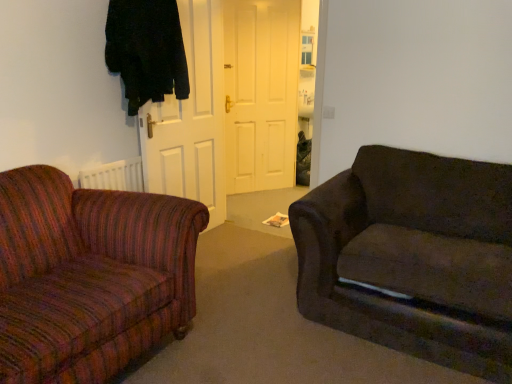
Image resolution: width=512 pixels, height=384 pixels. Find the location of `free spot in front of white matte door at center, which ranks as the first door in front-to-back order`. free spot in front of white matte door at center, which ranks as the first door in front-to-back order is located at coordinates (215, 259).